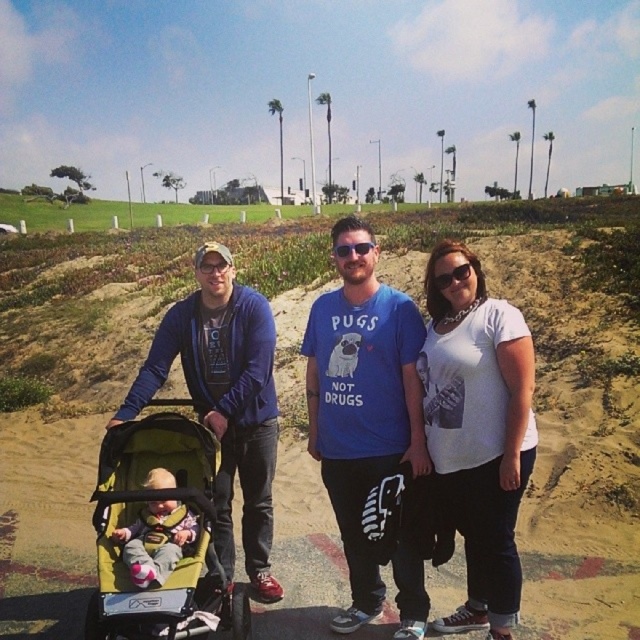
Question: Among these points, which one is farthest from the camera?

Choices:
 (A) (440, 401)
 (B) (200, 596)
 (C) (157, 468)
 (D) (508, 440)

Answer: (C)

Question: Does white cotton shirt at center have a smaller size compared to green fabric stroller at lower left?

Choices:
 (A) no
 (B) yes

Answer: (B)

Question: Can you confirm if matte blue shirt at center is positioned above soft yellow fabric at center?

Choices:
 (A) yes
 (B) no

Answer: (A)

Question: Does green fabric stroller at lower left appear under blue fleece jacket at left?

Choices:
 (A) yes
 (B) no

Answer: (A)

Question: Which of the following is the closest to the observer?

Choices:
 (A) (124, 548)
 (B) (500, 368)
 (C) (138, 547)
 (D) (257, 545)

Answer: (B)

Question: Which is farther from the matte blue shirt at center?

Choices:
 (A) blue fleece jacket at left
 (B) blue cotton t-shirt at center
 (C) white cotton shirt at center
 (D) green fabric stroller at lower left

Answer: (D)